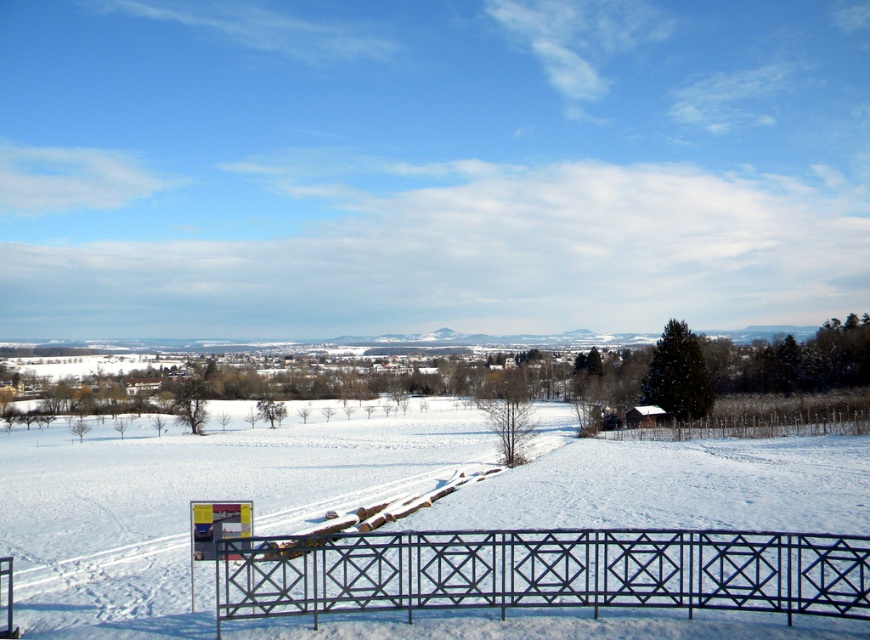
Identify the location of white powdery snow at center. This screenshot has width=870, height=640. (193, 499).

Is point (201, 570) farther from viewer compared to point (664, 557)?

Yes, it is.

The image size is (870, 640). What are the coordinates of `white powdery snow at center` in the screenshot? It's located at (193, 499).